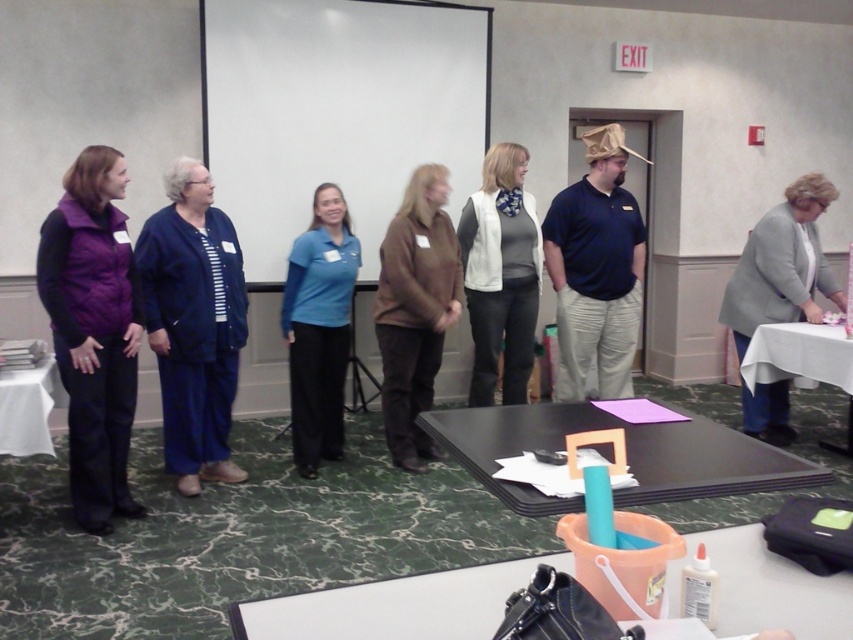
Which is in front, point (587, 177) or point (724, 323)?

Point (587, 177) is more forward.

Can you confirm if blue cotton shirt at center is positioned above gray woolen jacket at right?

Indeed, blue cotton shirt at center is positioned over gray woolen jacket at right.

Does point (593, 230) come closer to viewer compared to point (799, 273)?

Yes, point (593, 230) is in front of point (799, 273).

Identify the location of blue cotton shirt at center. This screenshot has width=853, height=640. (596, 269).

Does point (123, 216) come behind point (469, 292)?

No.

At what (x,y) coordinates should I click in order to perform the action: click on purple fleece vest at left. Please return your answer as a coordinate pair (x, y). Looking at the image, I should click on (93, 330).

Can you confirm if white matte projection screen at upper center is shorter than white cloth-covered table at right?

Incorrect, white matte projection screen at upper center's height does not fall short of white cloth-covered table at right's.

Between point (444, 156) and point (833, 333), which one is positioned behind?

The point (444, 156) is more distant.

What are the coordinates of `white matte projection screen at upper center` in the screenshot? It's located at tap(335, 112).